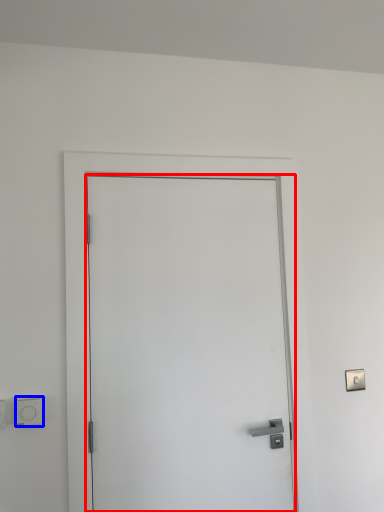
Question: Among these objects, which one is farthest to the camera, door (highlighted by a red box) or light switch (highlighted by a blue box)?

Choices:
 (A) door
 (B) light switch

Answer: (B)